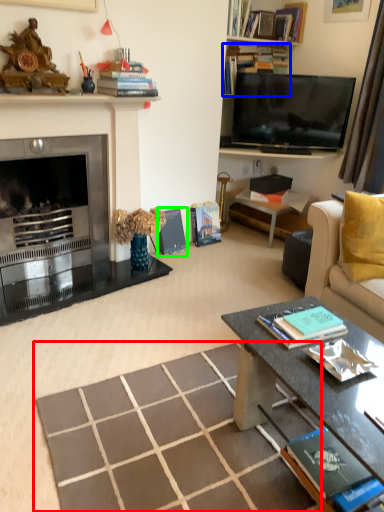
Question: Based on their relative distances, which object is farther from square (highlighted by a red box)? Choose from book (highlighted by a blue box) and book (highlighted by a green box).

Choices:
 (A) book
 (B) book

Answer: (A)